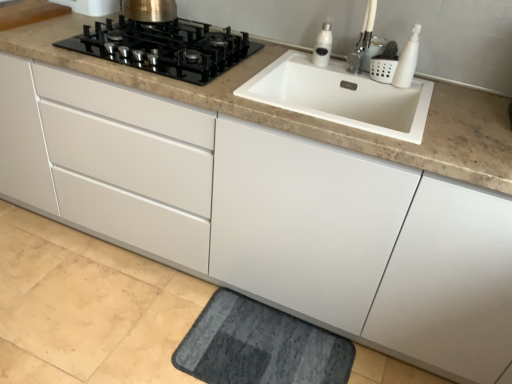
You are a GUI agent. You are given a task and a screenshot of the screen. Output one action in this format:
    pyautogui.click(x=<x>, y=<y>)
    Task: Click on the vacant space to the right of white glossy soap dispenser at upper right, the second soap dispenser from the right
    The image size is (512, 384).
    Given the screenshot: What is the action you would take?
    pyautogui.click(x=343, y=66)